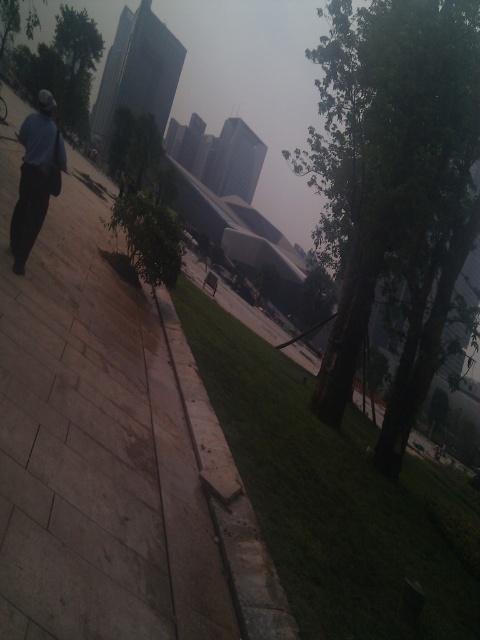
Question: Which of these objects is positioned closest to the dark blue shirt at left?

Choices:
 (A) green leafy tree at upper left
 (B) green leafy tree at center
 (C) light brown stone pavement at center
 (D) gray concrete curb at center

Answer: (C)

Question: Does green leafy tree at center appear over gray concrete curb at center?

Choices:
 (A) no
 (B) yes

Answer: (B)

Question: Can you confirm if gray concrete curb at center is smaller than green leafy tree at upper left?

Choices:
 (A) yes
 (B) no

Answer: (A)

Question: Can you confirm if light brown stone pavement at center is positioned above gray concrete curb at center?

Choices:
 (A) no
 (B) yes

Answer: (B)

Question: Among these points, which one is farthest from the camera?

Choices:
 (A) (202, 410)
 (B) (14, 234)

Answer: (A)

Question: Which object is positioned closest to the green leafy tree at upper left?

Choices:
 (A) gray concrete curb at center
 (B) light brown stone pavement at center
 (C) green leafy tree at center

Answer: (C)